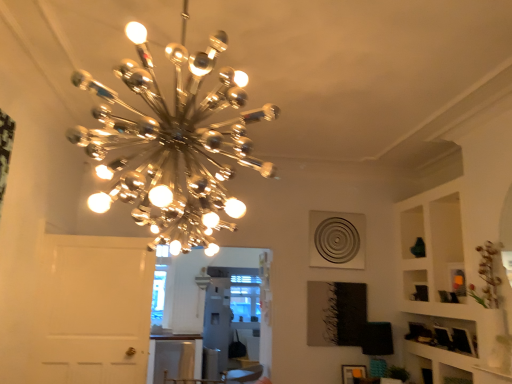
At what (x,y) coordinates should I click in order to perform the action: click on white glossy table at lower center. Please return your answer as a coordinate pair (x, y). Image resolution: width=512 pixels, height=384 pixels. Looking at the image, I should click on (174, 357).

This screenshot has width=512, height=384. Find the location of `matte orange picture frame at lower right`. matte orange picture frame at lower right is located at coordinates (353, 373).

Is chrome/metallic chandelier at upper center positioned with its back to matte orange picture frame at lower right?

That's not correct — chrome/metallic chandelier at upper center is not looking away from matte orange picture frame at lower right.

Considering the relative sizes of chrome/metallic chandelier at upper center and matte orange picture frame at lower right in the image provided, is chrome/metallic chandelier at upper center wider than matte orange picture frame at lower right?

Correct, the width of chrome/metallic chandelier at upper center exceeds that of matte orange picture frame at lower right.

Are chrome/metallic chandelier at upper center and matte orange picture frame at lower right far apart?

Yes, chrome/metallic chandelier at upper center is far from matte orange picture frame at lower right.

Which is more to the right, matte orange picture frame at lower right or chrome/metallic chandelier at upper center?

matte orange picture frame at lower right is more to the right.

Does point (353, 366) come behind point (213, 227)?

No.

Between matte orange picture frame at lower right and chrome/metallic chandelier at upper center, which one has larger size?

chrome/metallic chandelier at upper center.

Which object is further away from the camera, matte orange picture frame at lower right or chrome/metallic chandelier at upper center?

matte orange picture frame at lower right is behind.

Is white glossy table at lower center smaller than chrome/metallic chandelier at upper center?

Actually, white glossy table at lower center might be larger than chrome/metallic chandelier at upper center.

Is white glossy table at lower center spatially inside chrome/metallic chandelier at upper center, or outside of it?

white glossy table at lower center lies outside chrome/metallic chandelier at upper center.

How distant is white glossy table at lower center from chrome/metallic chandelier at upper center?

white glossy table at lower center is 3.15 meters from chrome/metallic chandelier at upper center.

Is white glossy table at lower center turned away from chrome/metallic chandelier at upper center?

white glossy table at lower center does not have its back to chrome/metallic chandelier at upper center.

Considering the relative sizes of white glossy table at lower center and matte orange picture frame at lower right in the image provided, is white glossy table at lower center shorter than matte orange picture frame at lower right?

No.

How many degrees apart are the facing directions of white glossy table at lower center and matte orange picture frame at lower right?

They differ by 4.2 degrees in their facing directions.

Between white glossy table at lower center and matte orange picture frame at lower right, which one appears on the right side from the viewer's perspective?

matte orange picture frame at lower right is more to the right.

I want to click on table located on the left of matte orange picture frame at lower right, so 174,357.

Is chrome/metallic chandelier at upper center oriented away from white glossy table at lower center?

No, chrome/metallic chandelier at upper center is not facing the opposite direction of white glossy table at lower center.

Locate an element on the screen. This screenshot has width=512, height=384. table behind the chrome/metallic chandelier at upper center is located at coordinates (174, 357).

From a real-world perspective, relative to white glossy table at lower center, is chrome/metallic chandelier at upper center vertically above or below?

From a real-world perspective, chrome/metallic chandelier at upper center is physically above white glossy table at lower center.

Considering the positions of objects chrome/metallic chandelier at upper center and white glossy table at lower center in the image provided, who is more to the left, chrome/metallic chandelier at upper center or white glossy table at lower center?

Positioned to the left is white glossy table at lower center.

Are matte orange picture frame at lower right and white glossy table at lower center located far from each other?

Indeed, matte orange picture frame at lower right is not near white glossy table at lower center.

Between matte orange picture frame at lower right and white glossy table at lower center, which one has more height?

With more height is white glossy table at lower center.

Which object is more forward, matte orange picture frame at lower right or white glossy table at lower center?

Positioned in front is matte orange picture frame at lower right.

Does point (343, 376) appear closer or farther from the camera than point (151, 367)?

Clearly, point (343, 376) is closer to the camera than point (151, 367).

This screenshot has height=384, width=512. There is a matte orange picture frame at lower right. Find the location of `lamp above it (from a real-world perspective)`. lamp above it (from a real-world perspective) is located at coordinates (173, 143).

Find the location of a particular element. lamp that appears above the matte orange picture frame at lower right (from the image's perspective) is located at coordinates (173, 143).

From the image, which object appears to be nearer to white glossy table at lower center, matte orange picture frame at lower right or chrome/metallic chandelier at upper center?

Among the two, matte orange picture frame at lower right is located nearer to white glossy table at lower center.

Considering their positions, is white glossy table at lower center positioned closer to chrome/metallic chandelier at upper center than matte orange picture frame at lower right?

matte orange picture frame at lower right is positioned closer to the anchor chrome/metallic chandelier at upper center.

From the image, which object appears to be farther from matte orange picture frame at lower right, white glossy table at lower center or chrome/metallic chandelier at upper center?

white glossy table at lower center lies further to matte orange picture frame at lower right than the other object.

When comparing their distances from matte orange picture frame at lower right, does chrome/metallic chandelier at upper center or white glossy table at lower center seem further?

white glossy table at lower center lies further to matte orange picture frame at lower right than the other object.

Estimate the real-world distances between objects in this image. Which object is closer to chrome/metallic chandelier at upper center, matte orange picture frame at lower right or white glossy table at lower center?

matte orange picture frame at lower right.

Based on their spatial positions, is chrome/metallic chandelier at upper center or matte orange picture frame at lower right closer to white glossy table at lower center?

matte orange picture frame at lower right.

Locate an element on the screen. picture frame between chrome/metallic chandelier at upper center and white glossy table at lower center in the front-back direction is located at coordinates (353, 373).